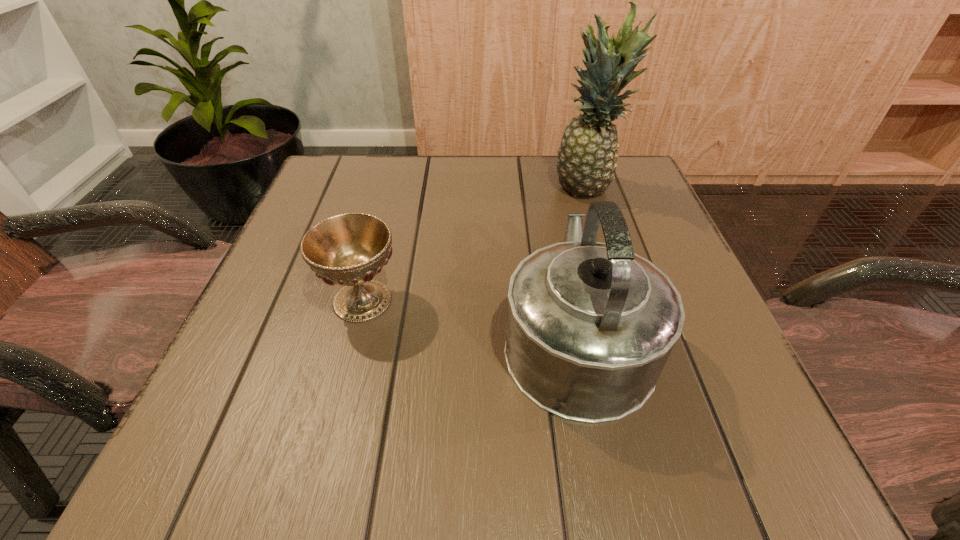
This screenshot has width=960, height=540. I want to click on the closest object to the second shortest object, so click(349, 249).

Where is `vacant area that satisfies the following two spatial constraints: 1. with the spout at the front of the pineapple; 2. on the left side of the kettle`? Image resolution: width=960 pixels, height=540 pixels. vacant area that satisfies the following two spatial constraints: 1. with the spout at the front of the pineapple; 2. on the left side of the kettle is located at coordinates (547, 189).

I want to click on free space that satisfies the following two spatial constraints: 1. with the spout at the front of the pineapple; 2. on the left side of the second tallest object, so click(x=547, y=189).

The height and width of the screenshot is (540, 960). I want to click on free spot that satisfies the following two spatial constraints: 1. with the spout at the front of the second tallest object; 2. on the right side of the pineapple, so click(x=547, y=189).

Identify the location of vacant space that satisfies the following two spatial constraints: 1. with the spout at the front of the tallest object; 2. on the left side of the kettle. The image size is (960, 540). (547, 189).

Where is `free location that satisfies the following two spatial constraints: 1. with the spout at the front of the tallest object; 2. on the right side of the second tallest object`? This screenshot has width=960, height=540. free location that satisfies the following two spatial constraints: 1. with the spout at the front of the tallest object; 2. on the right side of the second tallest object is located at coordinates (547, 189).

At what (x,y) coordinates should I click in order to perform the action: click on vacant space that satisfies the following two spatial constraints: 1. on the back side of the shortest object; 2. on the right side of the tallest object. Please return your answer as a coordinate pair (x, y). Image resolution: width=960 pixels, height=540 pixels. Looking at the image, I should click on (392, 189).